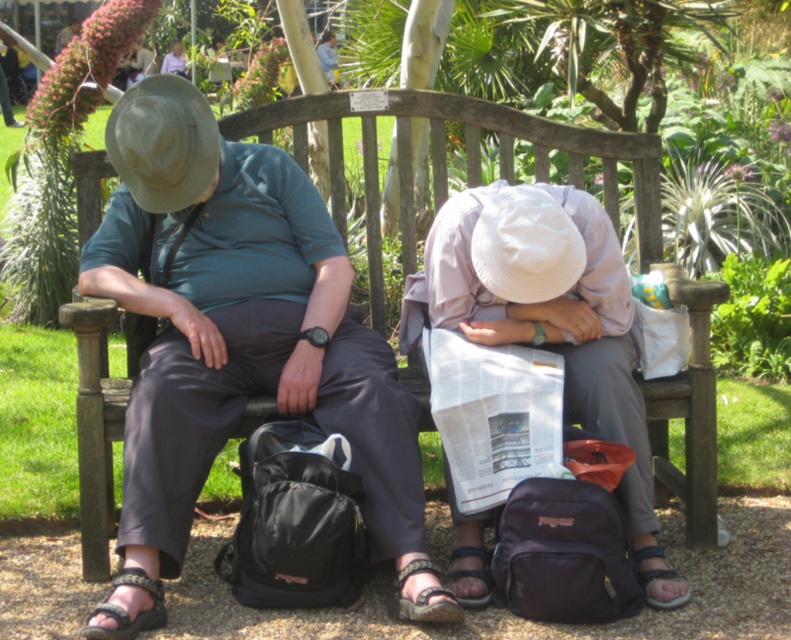
Is matte gray hat at left positioned behind white matte hat at center?

No, it is in front of white matte hat at center.

Looking at this image, between matte gray hat at left and white matte hat at center, which one appears on the right side from the viewer's perspective?

From the viewer's perspective, white matte hat at center appears more on the right side.

Is point (269, 177) in front of point (589, 424)?

No, (269, 177) is behind (589, 424).

This screenshot has width=791, height=640. Find the location of `matte gray hat at left`. matte gray hat at left is located at coordinates (239, 340).